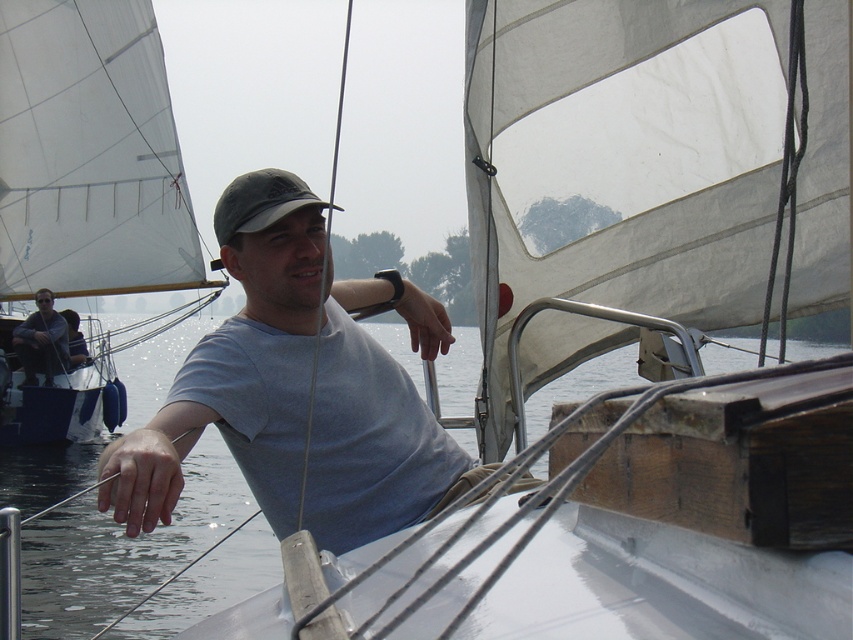
Between point (157, 451) and point (309, 189), which one is positioned in front?

Point (157, 451)

Is point (310, 481) positioned before point (251, 228)?

That is False.

I want to click on gray cotton t-shirt at center, so click(239, 364).

Is point (218, 205) closer to viewer compared to point (27, 358)?

Yes, point (218, 205) is in front of point (27, 358).

Who is more distant from viewer, (231, 227) or (51, 300)?

The point (51, 300) is more distant.

At what (x,y) coordinates should I click in order to perform the action: click on gray fabric baseball cap at center. Please return your answer as a coordinate pair (x, y). Image resolution: width=853 pixels, height=640 pixels. Looking at the image, I should click on (260, 202).

Is gray cotton t-shirt at center taller than matte black shirt at left?

No.

Does gray cotton t-shirt at center have a lesser width compared to matte black shirt at left?

No, gray cotton t-shirt at center is not thinner than matte black shirt at left.

This screenshot has height=640, width=853. Describe the element at coordinates (239, 364) in the screenshot. I see `gray cotton t-shirt at center` at that location.

Where is `gray cotton t-shirt at center`? gray cotton t-shirt at center is located at coordinates (239, 364).